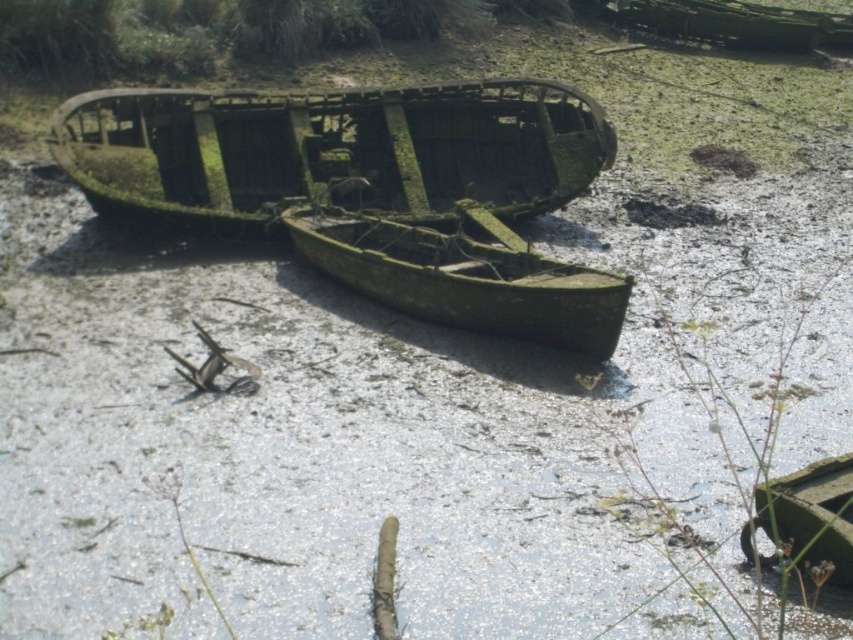
You are standing at the point marked as point (331, 150) in the image. What object are you directly facing?

The point (331, 150) indicates green mossy wood boat at center, so you are directly facing the green mossy wood boat at center.

You are standing at the edge of the dried riverbed and want to walk to the green mossy wood canoe at center. Which direction should you go relative to the green mossy wood boat at center?

The green mossy wood canoe at center is behind the green mossy wood boat at center, so you should walk towards the direction away from the green mossy wood boat at center to reach the canoe.